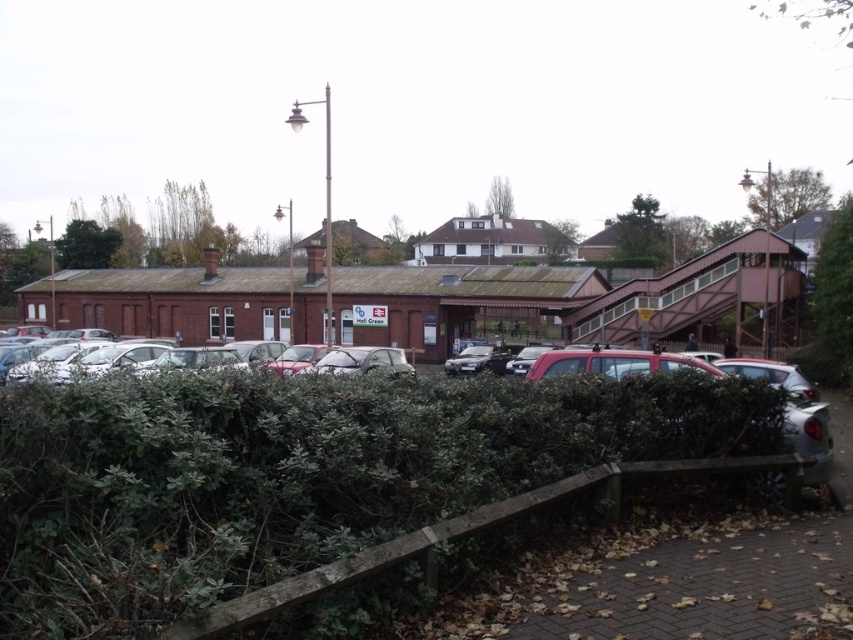
Based on the photo, can you confirm if green leafy hedge at lower left is smaller than silver metallic car at center?

Indeed, green leafy hedge at lower left has a smaller size compared to silver metallic car at center.

Is point (666, 444) farther from camera compared to point (358, 352)?

No, it is not.

Identify the location of green leafy hedge at lower left. The height and width of the screenshot is (640, 853). (294, 474).

This screenshot has height=640, width=853. In order to click on green leafy hedge at lower left in this screenshot , I will do `click(294, 474)`.

Can you confirm if green leafy bush at upper left is bigger than metallic silver car at center?

Yes.

Does green leafy bush at upper left have a greater width compared to metallic silver car at center?

Yes.

Locate an element on the screen. Image resolution: width=853 pixels, height=640 pixels. green leafy bush at upper left is located at coordinates (86, 244).

Is green leafy hedge at lower left to the right of metallic silver car at center from the viewer's perspective?

No, green leafy hedge at lower left is not to the right of metallic silver car at center.

Consider the image. Can you confirm if green leafy hedge at lower left is bigger than metallic silver car at center?

No, green leafy hedge at lower left is not bigger than metallic silver car at center.

I want to click on green leafy hedge at lower left, so click(x=294, y=474).